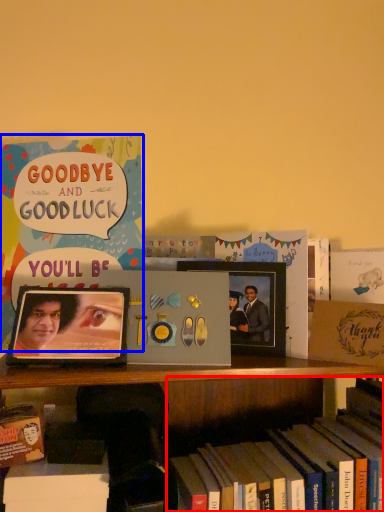
Question: Which point is further to the camera, book (highlighted by a red box) or book (highlighted by a blue box)?

Choices:
 (A) book
 (B) book

Answer: (B)